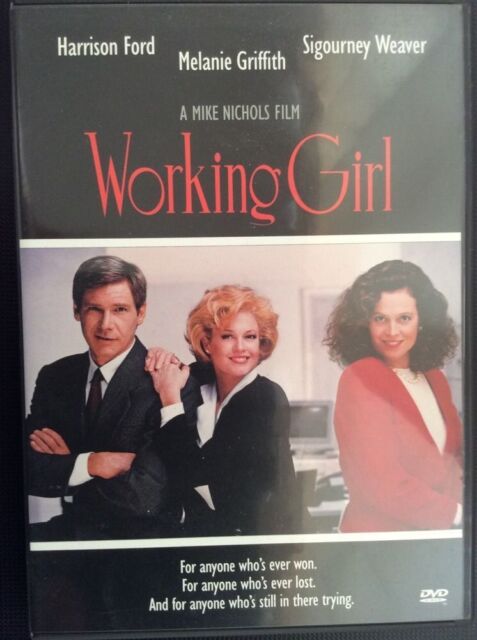
Locate an element on the screen. wall is located at coordinates (188, 272).